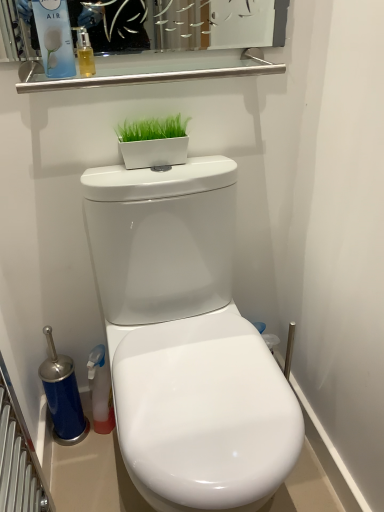
Identify the location of vacant area to the right of matte blue air freshener at upper left. This screenshot has width=384, height=512. (137, 74).